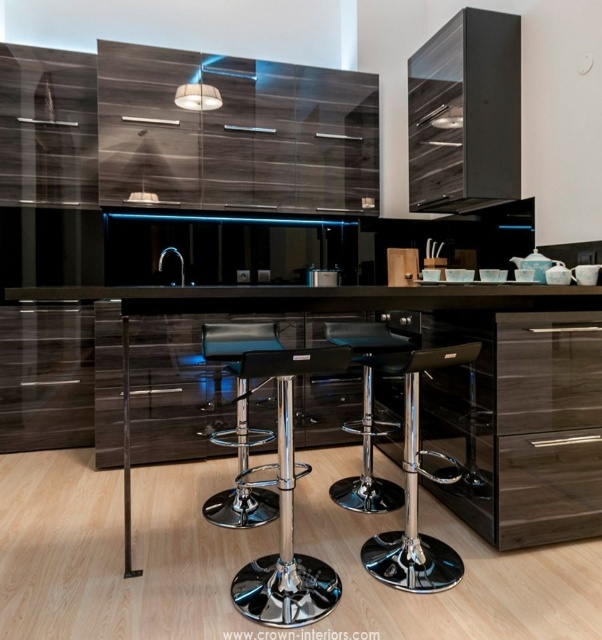
You are a chef standing in the kitchen and want to reach the glossy wood exhaust hood at upper center to adjust the ventilation. Considering your height and arm reach, which is 1.8 meters, can you reach it without any tools?

The glossy wood exhaust hood at upper center is 2.83 meters from viewer. Since your maximum reach is 1.8 meters, you cannot reach it without assistance or tools.